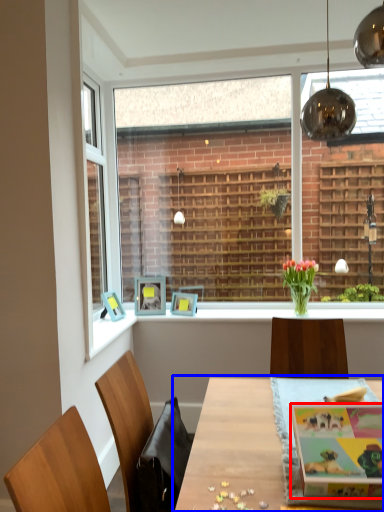
Question: Which object is further to the camera taking this photo, magazine (highlighted by a red box) or table (highlighted by a blue box)?

Choices:
 (A) magazine
 (B) table

Answer: (A)